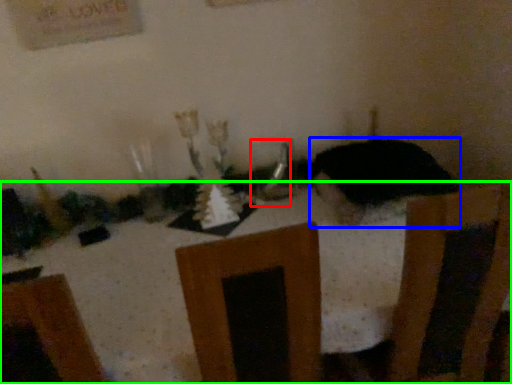
Question: Estimate the real-world distances between objects in this image. Which object is closer to tableware (highlighted by a red box), animal (highlighted by a blue box) or furniture (highlighted by a green box)?

Choices:
 (A) animal
 (B) furniture

Answer: (A)